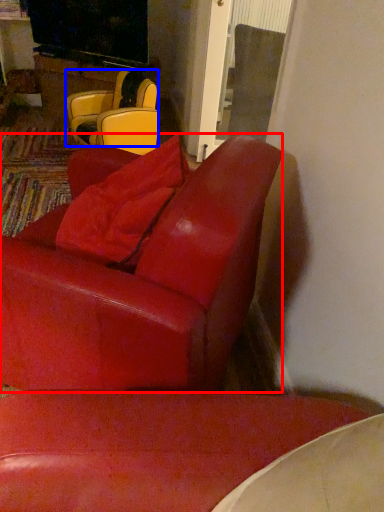
Question: Among these objects, which one is nearest to the camera, chair (highlighted by a red box) or chair (highlighted by a blue box)?

Choices:
 (A) chair
 (B) chair

Answer: (A)